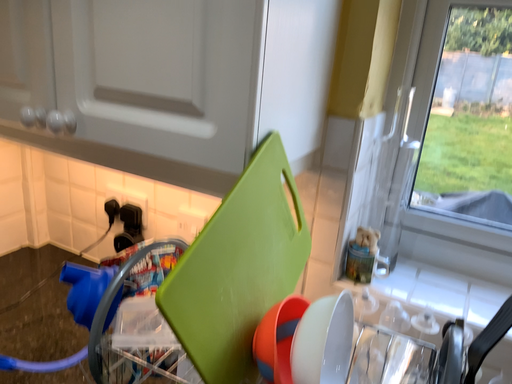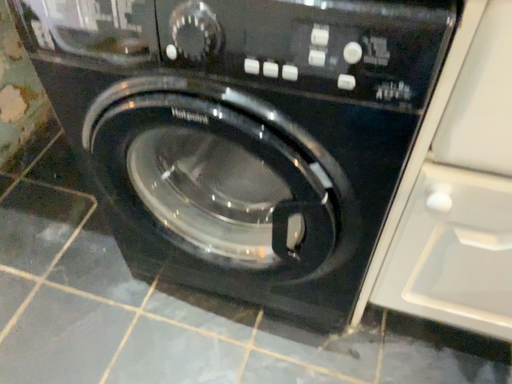
Question: How did the camera likely rotate when shooting the video?

Choices:
 (A) rotated left
 (B) rotated right

Answer: (B)